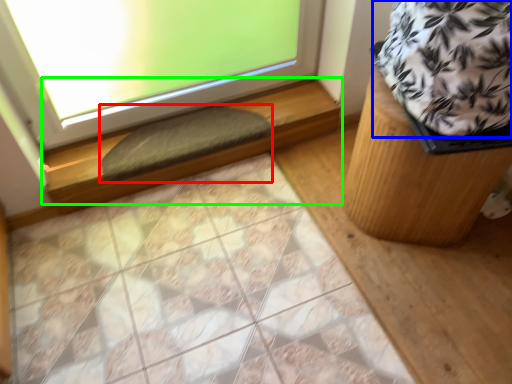
Question: Estimate the real-world distances between objects in this image. Which object is closer to doormat (highlighted by a red box), blanket (highlighted by a blue box) or window sill (highlighted by a green box)?

Choices:
 (A) blanket
 (B) window sill

Answer: (B)